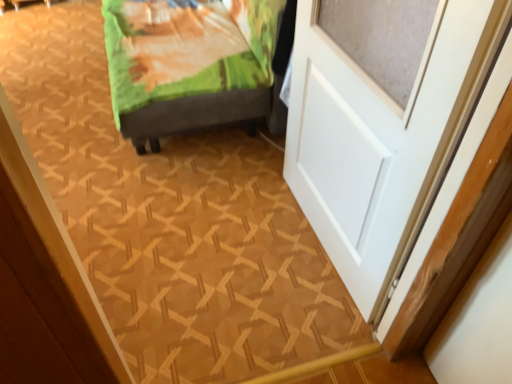
Question: Should I look upward or downward to see green fabric bed at upper left?

Choices:
 (A) down
 (B) up

Answer: (B)

Question: Should I look upward or downward to see white matte door at right?

Choices:
 (A) down
 (B) up

Answer: (B)

Question: From the image's perspective, is white matte door at right located beneath green fabric bed at upper left?

Choices:
 (A) no
 (B) yes

Answer: (B)

Question: Is white matte door at right surrounding green fabric bed at upper left?

Choices:
 (A) yes
 (B) no

Answer: (B)

Question: Does white matte door at right appear on the right side of green fabric bed at upper left?

Choices:
 (A) no
 (B) yes

Answer: (B)

Question: Does white matte door at right have a greater height compared to green fabric bed at upper left?

Choices:
 (A) yes
 (B) no

Answer: (A)

Question: Considering the relative sizes of white matte door at right and green fabric bed at upper left in the image provided, is white matte door at right thinner than green fabric bed at upper left?

Choices:
 (A) yes
 (B) no

Answer: (A)

Question: Are white matte door at right and green fabric bed at upper left beside each other?

Choices:
 (A) yes
 (B) no

Answer: (B)

Question: Does green fabric bed at upper left have a larger size compared to white matte door at right?

Choices:
 (A) yes
 (B) no

Answer: (A)

Question: Is there a large distance between green fabric bed at upper left and white matte door at right?

Choices:
 (A) no
 (B) yes

Answer: (A)

Question: From the image's perspective, does green fabric bed at upper left appear lower than white matte door at right?

Choices:
 (A) yes
 (B) no

Answer: (B)

Question: Is green fabric bed at upper left oriented away from white matte door at right?

Choices:
 (A) yes
 (B) no

Answer: (B)

Question: Is green fabric bed at upper left wider than white matte door at right?

Choices:
 (A) no
 (B) yes

Answer: (B)

Question: Considering the relative sizes of green fabric bed at upper left and white matte door at right in the image provided, is green fabric bed at upper left taller than white matte door at right?

Choices:
 (A) yes
 (B) no

Answer: (B)

Question: Do you think green fabric bed at upper left is within white matte door at right, or outside of it?

Choices:
 (A) outside
 (B) inside

Answer: (A)